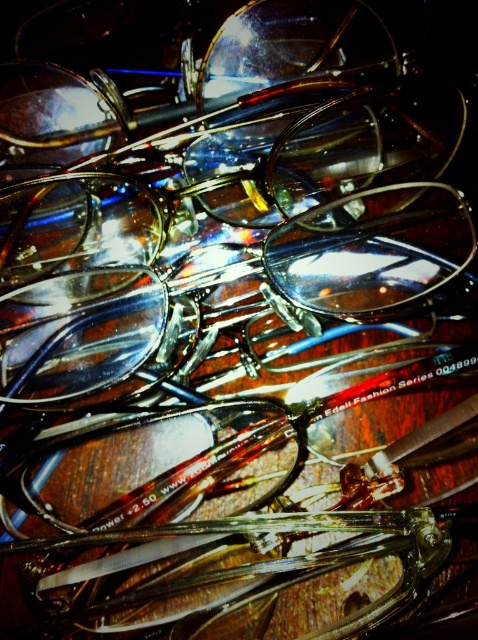
Question: Which object appears farthest from the camera in this image?

Choices:
 (A) shiny metallic glasses at center
 (B) shiny brown glasses at center

Answer: (A)

Question: Is shiny brown glasses at center above shiny metallic glasses at center?

Choices:
 (A) yes
 (B) no

Answer: (A)

Question: Is shiny brown glasses at center positioned at the back of shiny metallic glasses at center?

Choices:
 (A) yes
 (B) no

Answer: (B)

Question: Among these objects, which one is farthest from the camera?

Choices:
 (A) shiny brown glasses at center
 (B) shiny metallic glasses at center

Answer: (B)

Question: Is shiny brown glasses at center closer to camera compared to shiny metallic glasses at center?

Choices:
 (A) yes
 (B) no

Answer: (A)